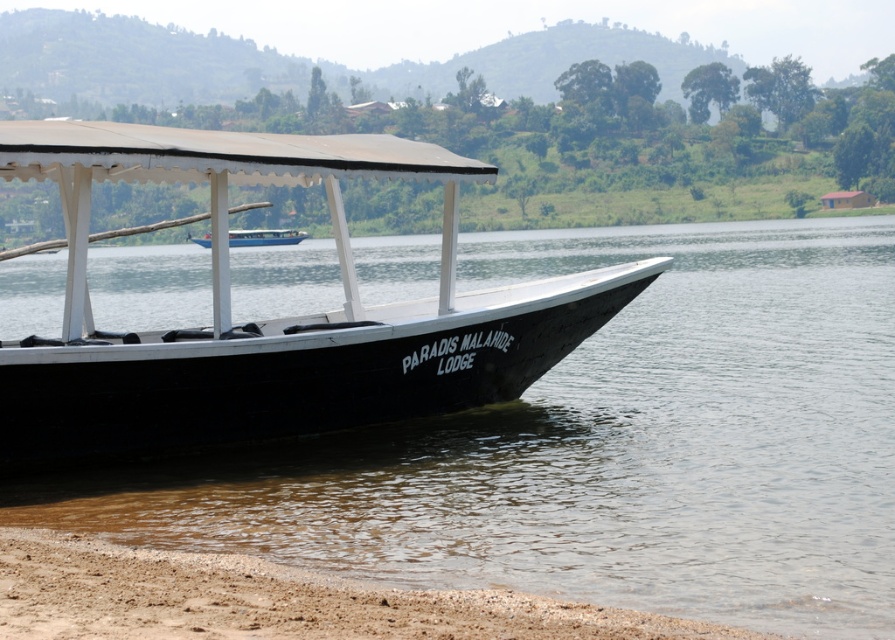
Consider the image. You are standing at the boat docked on the left side of the frame. You want to check the water quality at point (599, 445). Is the water clear or murky there?

The water at point (599, 445) is clear.

In the scene shown: You are standing on the dock and want to take a photo of the black wood boat at center and the clear water at boat right. Which object should you focus on first to ensure both are in the frame?

You should focus on the black wood boat at center first because it is farther away than the clear water at boat right, so adjusting focus to the boat ensures both are in the frame.

You are planning to take a small boat ride from the brown sandy shore at lower left to the clear water at boat right. Which area will you have more space to move around in?

The clear water at boat right is larger in size than the brown sandy shore at lower left, so you will have more space to move around in the clear water at boat right.